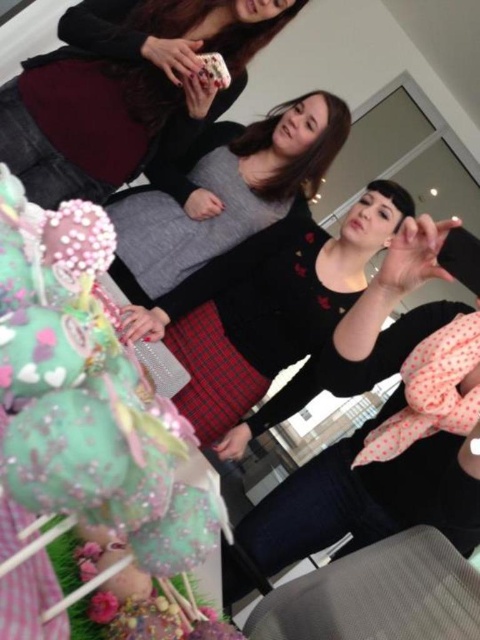
You are standing in the room and want to pick up the matte black phone at upper center and the pink dotted fabric at center. Which object will you need to reach for first?

The matte black phone at upper center is closer to you than the pink dotted fabric at center, so you will need to reach for the matte black phone at upper center first.

You are planning to take a photo of the matte black phone at upper center and the black matte dress at center. Which object should you focus on first if you want to capture both in the same frame without moving the camera?

You should focus on the black matte dress at center first because it is taller than the matte black phone at upper center, ensuring it is fully in frame.